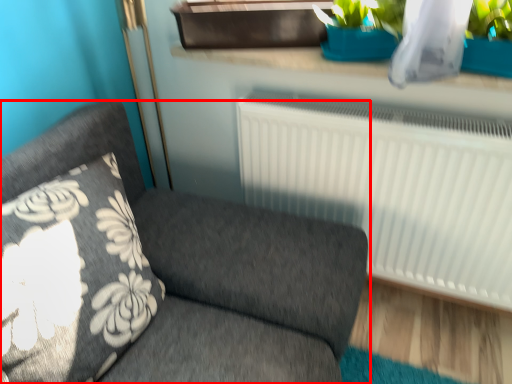
Question: Considering the relative positions of furniture (annotated by the red box) and window sill in the image provided, where is furniture (annotated by the red box) located with respect to the staircase?

Choices:
 (A) right
 (B) left

Answer: (B)